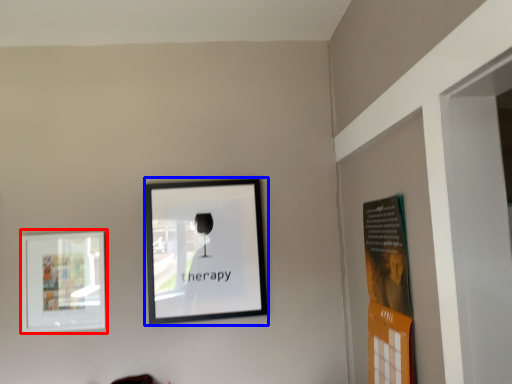
Question: Which object is further to the camera taking this photo, picture frame (highlighted by a red box) or picture frame (highlighted by a blue box)?

Choices:
 (A) picture frame
 (B) picture frame

Answer: (B)